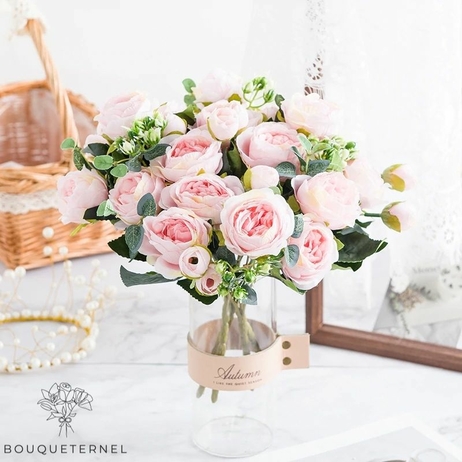
Where is `glass holder for flowers`? The width and height of the screenshot is (462, 462). glass holder for flowers is located at coordinates (205, 314), (268, 300), (261, 420), (205, 427).